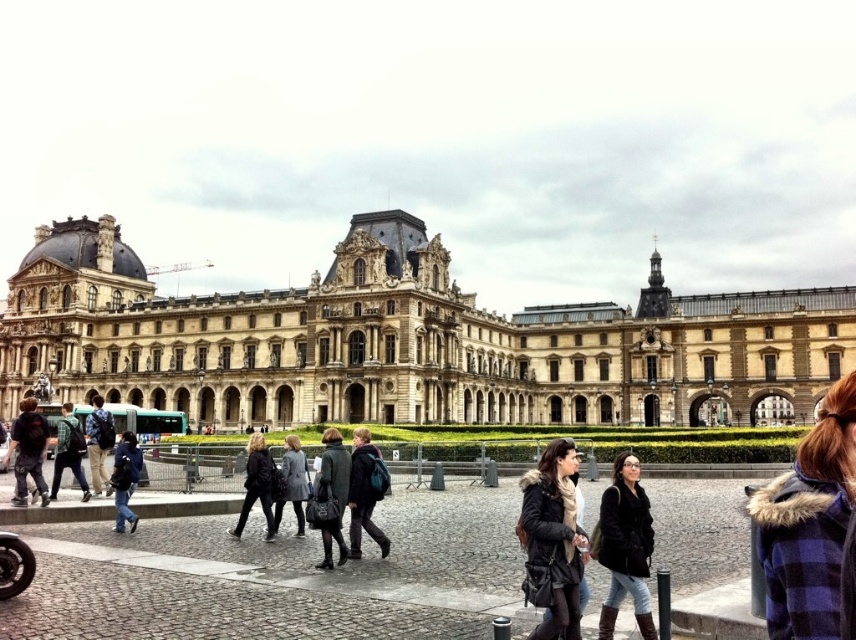
Who is positioned more to the right, gray wool coat at center or denim jacket at center?

Positioned to the right is gray wool coat at center.

Which is behind, point (288, 497) or point (97, 465)?

Point (97, 465)

At what (x,y) coordinates should I click in order to perform the action: click on gray wool coat at center. Please return your answer as a coordinate pair (x, y). The width and height of the screenshot is (856, 640). Looking at the image, I should click on (292, 483).

Who is higher up, matte black backpack at center or black leather jacket at center?

matte black backpack at center is above.

Is matte black backpack at center taller than black leather jacket at center?

No, matte black backpack at center is not taller than black leather jacket at center.

Measure the distance between matte black backpack at center and camera.

They are 41.56 meters apart.

The height and width of the screenshot is (640, 856). In order to click on matte black backpack at center in this screenshot , I will do coord(363,493).

From the picture: Can you confirm if black leather jacket at lower center is shorter than denim jacket at center?

In fact, black leather jacket at lower center may be taller than denim jacket at center.

The height and width of the screenshot is (640, 856). Describe the element at coordinates (553, 538) in the screenshot. I see `black leather jacket at lower center` at that location.

Identify the location of black leather jacket at lower center. (553, 538).